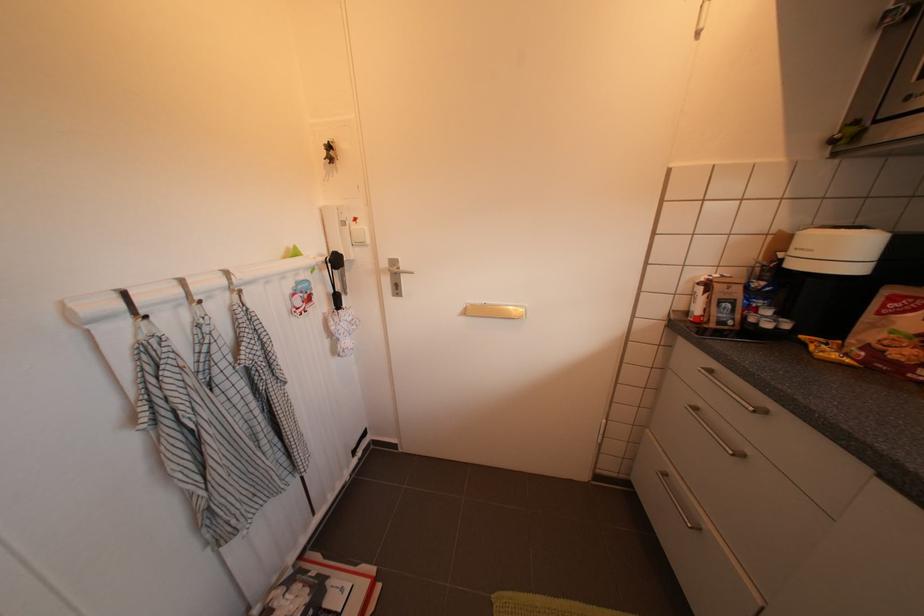
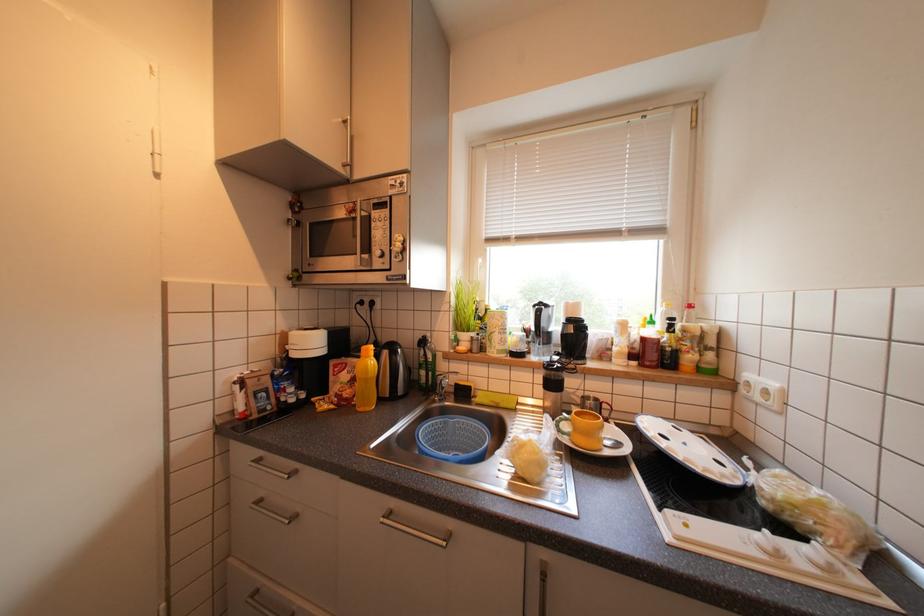
Question: Based on the continuous images, in which direction is the camera rotating? Reply with the corresponding letter.

Choices:
 (A) Left
 (B) Right
 (C) Up
 (D) Down

Answer: (B)